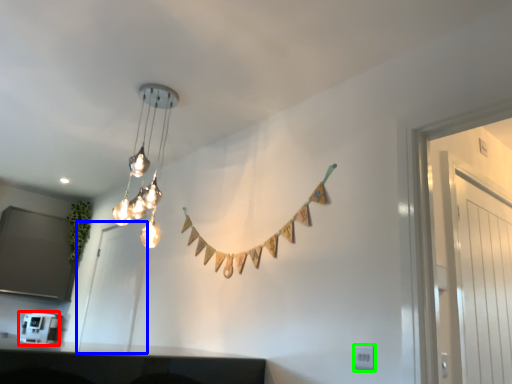
Question: Estimate the real-world distances between objects in this image. Which object is closer to appliance (highlighted by a red box), glass door (highlighted by a blue box) or electric outlet (highlighted by a green box)?

Choices:
 (A) glass door
 (B) electric outlet

Answer: (A)